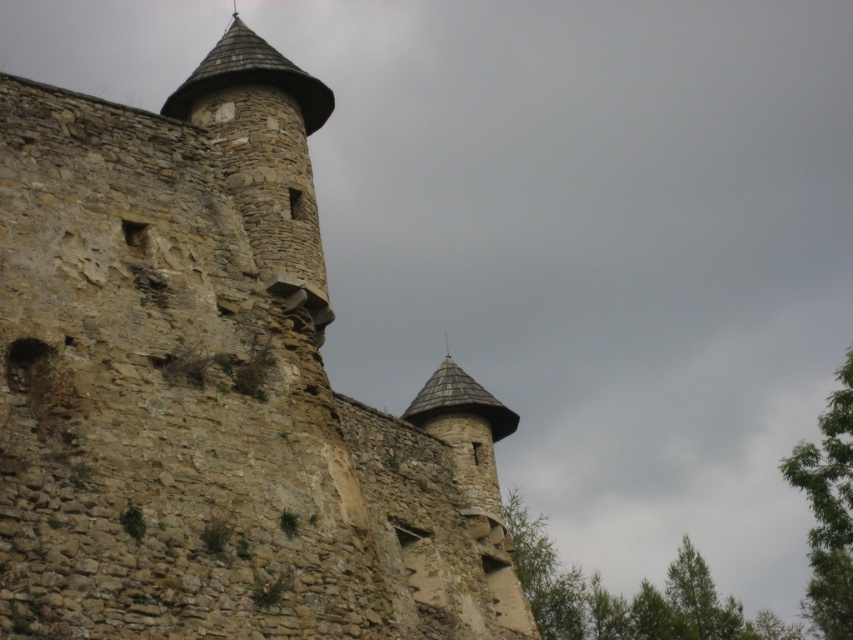
You are a medieval knight standing at the base of the green leafy tree at right. You want to climb up to the rustic stone tower at upper left. Is the tower above or below the tree?

The rustic stone tower at upper left is located above the green leafy tree at right, so the tower is above the tree.

You are a medieval archer positioned at the base of the rustic stone tower at upper left. You spot an enemy soldier hiding behind the green leafy tree at upper center. If your arrow can travel 250 feet, will you be able to hit the enemy?

The rustic stone tower at upper left is 252.01 feet away from the green leafy tree at upper center. Since your arrow can only travel 250 feet, you will not be able to hit the enemy.